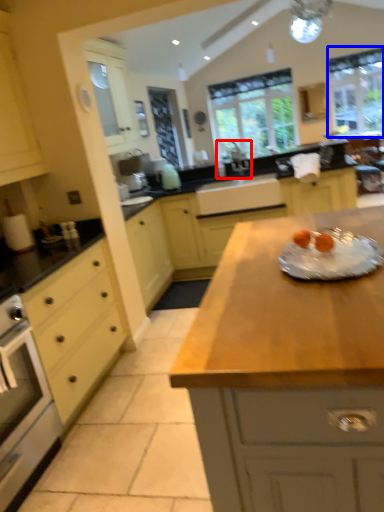
Question: Which object appears closest to the camera in this image, sink (highlighted by a red box) or window (highlighted by a blue box)?

Choices:
 (A) sink
 (B) window

Answer: (A)